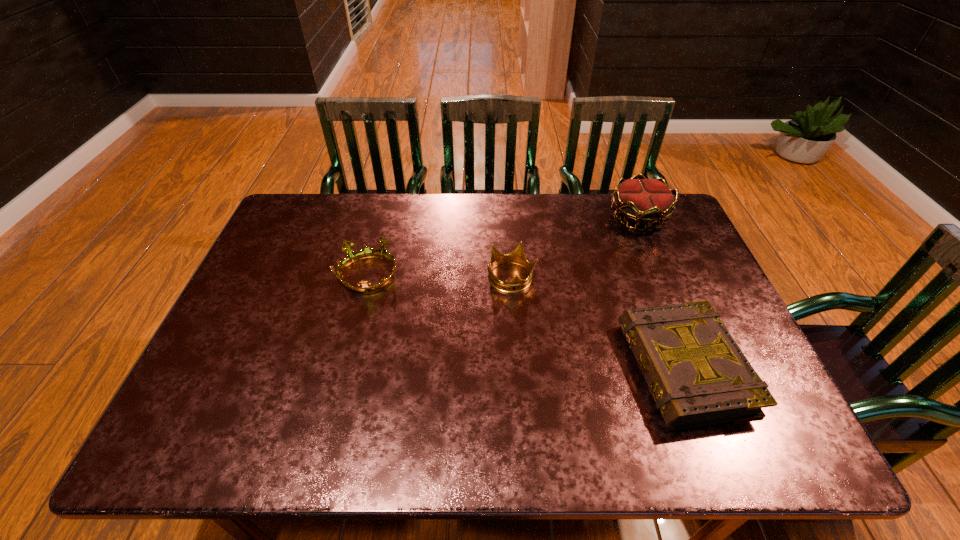
Locate an element on the screen. The image size is (960, 540). object located in the near edge section of the desktop is located at coordinates (697, 374).

Where is `crown present at the right edge`? crown present at the right edge is located at coordinates (645, 201).

This screenshot has width=960, height=540. I want to click on hardback book that is at the right edge, so click(x=697, y=374).

Identify the location of object that is at the far right corner. (645, 201).

I want to click on object situated at the near right corner, so click(697, 374).

You are a GUI agent. You are given a task and a screenshot of the screen. Output one action in this format:
    pyautogui.click(x=<x>, y=<y>)
    Task: Click on the vacant space at the far edge of the desktop
    The width and height of the screenshot is (960, 540).
    Given the screenshot: What is the action you would take?
    pyautogui.click(x=604, y=210)

Image resolution: width=960 pixels, height=540 pixels. In the image, there is a desktop. In order to click on vacant region at the near edge in this screenshot , I will do `click(245, 443)`.

Find the location of a particular element. This screenshot has width=960, height=540. vacant space at the left edge of the desktop is located at coordinates (259, 354).

In the image, there is a desktop. What are the coordinates of `vacant space at the far left corner` in the screenshot? It's located at (292, 207).

Locate an element on the screen. The image size is (960, 540). free area in between the second object from left to right and the leftmost object is located at coordinates (441, 276).